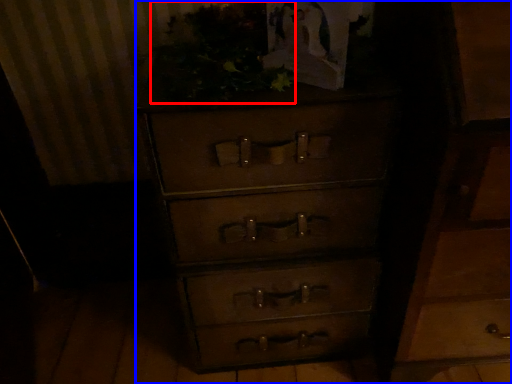
Question: Which point is closer to the camera, vegetation (highlighted by a red box) or chest of drawers (highlighted by a blue box)?

Choices:
 (A) vegetation
 (B) chest of drawers

Answer: (A)